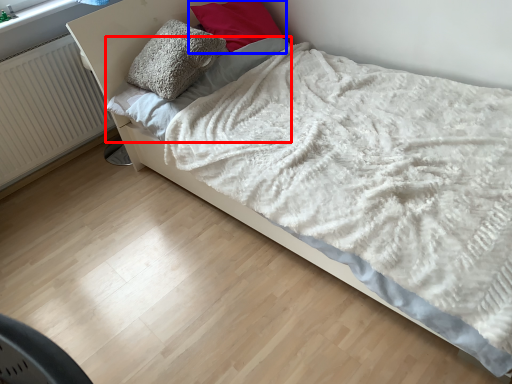
Question: Which object is closer to the camera taking this photo, sheet (highlighted by a red box) or pillow (highlighted by a blue box)?

Choices:
 (A) sheet
 (B) pillow

Answer: (A)